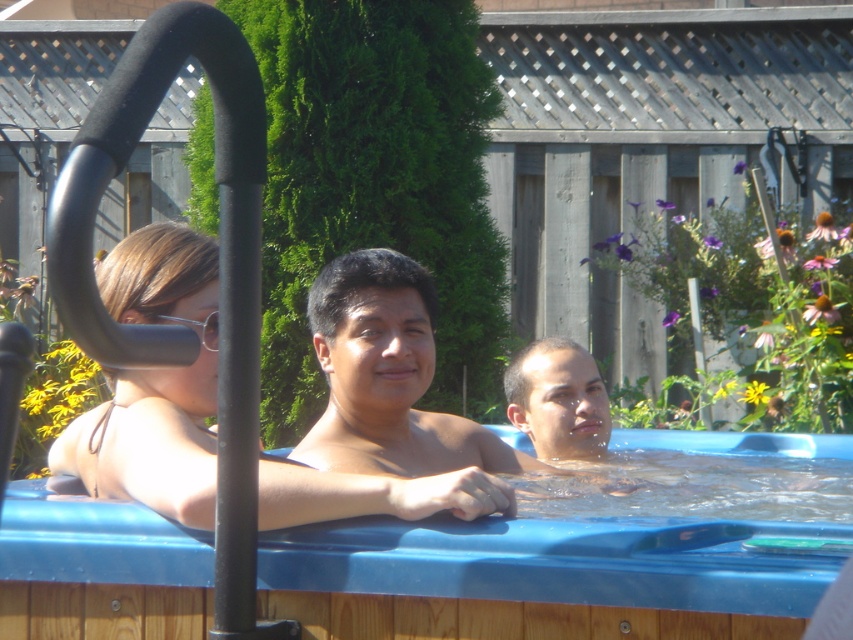
Question: Does matte black bikini top at center have a greater width compared to smooth skin man at center?

Choices:
 (A) yes
 (B) no

Answer: (A)

Question: Which object appears closest to the camera in this image?

Choices:
 (A) matte black bikini top at center
 (B) blue plastic hot tub at center

Answer: (B)

Question: Where is matte black bikini top at center located in relation to smooth skin man at center in the image?

Choices:
 (A) below
 (B) above

Answer: (A)

Question: Which of the following is the farthest from the observer?

Choices:
 (A) (178, 548)
 (B) (160, 269)
 (C) (390, 449)

Answer: (C)

Question: Is blue plastic hot tub at center wider than matte black bikini top at center?

Choices:
 (A) no
 (B) yes

Answer: (B)

Question: Which of these objects is positioned farthest from the matte black bikini top at center?

Choices:
 (A) blue plastic hot tub at center
 (B) smooth skin man at center

Answer: (B)